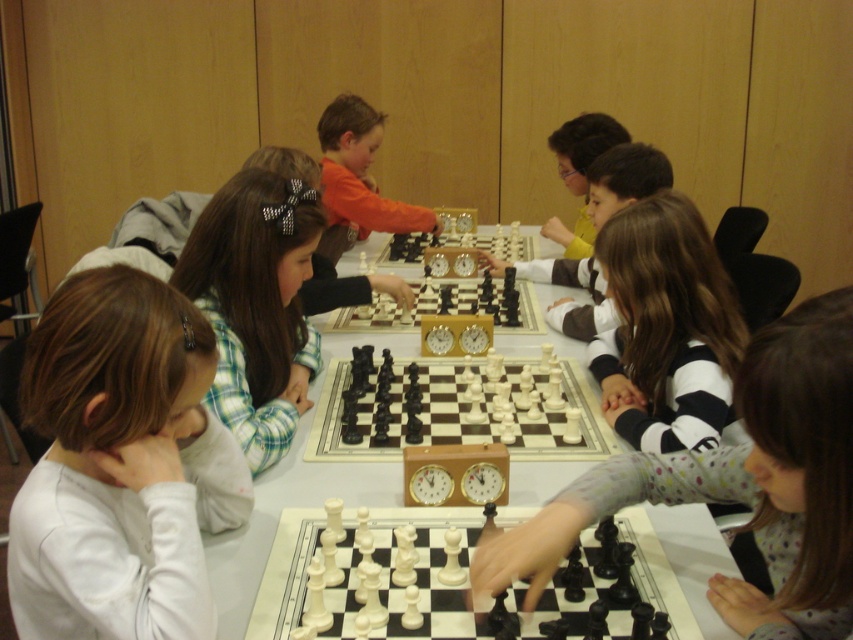
Is white matte shirt at lower left taller than orange fabric shirt at center?

Incorrect, white matte shirt at lower left's height is not larger of orange fabric shirt at center's.

In the scene shown: Is white matte shirt at lower left behind orange fabric shirt at center?

No, white matte shirt at lower left is closer to the viewer.

Who is more distant from viewer, (91,572) or (317,122)?

Point (317,122)

The width and height of the screenshot is (853, 640). What are the coordinates of `white matte shirt at lower left` in the screenshot? It's located at (120, 464).

Who is more forward, (686, 490) or (251, 282)?

Point (686, 490) is more forward.

Consider the image. Can you confirm if polka dot fabric shirt at center is smaller than plaid fabric shirt at center?

Indeed, polka dot fabric shirt at center has a smaller size compared to plaid fabric shirt at center.

This screenshot has height=640, width=853. What are the coordinates of `polka dot fabric shirt at center` in the screenshot? It's located at (738, 484).

Is black and white striped shirt at center above plaid fabric shirt at center?

No.

At what (x,y) coordinates should I click in order to perform the action: click on black and white striped shirt at center. Please return your answer as a coordinate pair (x, y). Image resolution: width=853 pixels, height=640 pixels. Looking at the image, I should click on (666, 328).

Is point (666, 228) in front of point (227, 401)?

No, it is behind (227, 401).

Locate an element on the screen. The width and height of the screenshot is (853, 640). black and white striped shirt at center is located at coordinates (666, 328).